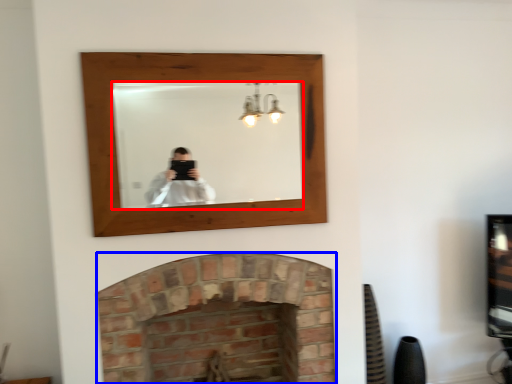
Question: Which object is further to the camera taking this photo, mirror (highlighted by a red box) or fireplace (highlighted by a blue box)?

Choices:
 (A) mirror
 (B) fireplace

Answer: (B)